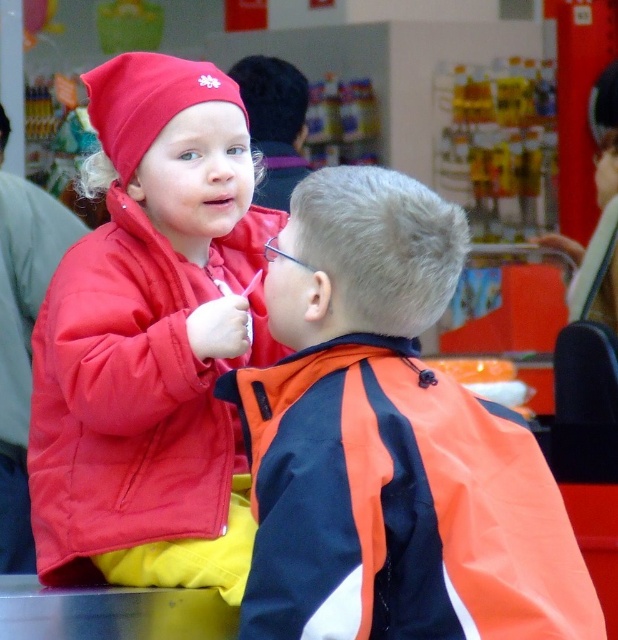
Question: Can you confirm if blonde hair at upper center is thinner than short dark hair at upper center?

Choices:
 (A) yes
 (B) no

Answer: (A)

Question: Which point appears closest to the camera in this image?

Choices:
 (A) (266, 140)
 (B) (552, 600)
 (C) (265, 364)
 (D) (413, 256)

Answer: (B)

Question: Which point is farther to the camera?

Choices:
 (A) (159, 237)
 (B) (533, 472)
 (C) (324, 236)

Answer: (A)

Question: Does orange fabric jacket at center come behind matte red jacket at upper left?

Choices:
 (A) yes
 (B) no

Answer: (B)

Question: Considering the real-world distances, which object is closest to the short dark hair at upper center?

Choices:
 (A) matte red jacket at upper left
 (B) orange fabric jacket at center

Answer: (A)

Question: Is orange fabric jacket at center behind matte red jacket at upper left?

Choices:
 (A) no
 (B) yes

Answer: (A)